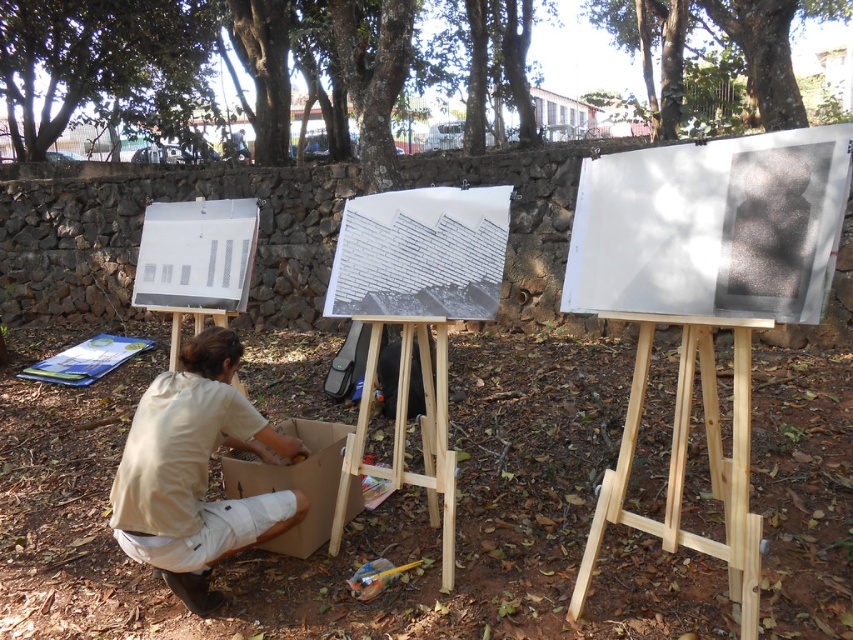
Looking at this image, who is more distant from viewer, (668, 483) or (126, 35)?

The point (126, 35) is behind.

Between wooden easel at center and green leafy tree at upper left, which one is positioned lower?

wooden easel at center is below.

Who is more forward, [758,241] or [125,29]?

Result: Positioned in front is point [758,241].

Locate an element on the screen. The image size is (853, 640). wooden easel at center is located at coordinates point(705,300).

Between white paper at center and green leafy tree at upper center, which one is positioned higher?

Positioned higher is green leafy tree at upper center.

Which is in front, point (474, 296) or point (802, 122)?

Point (474, 296) is in front.

Which is in front, point (440, 452) or point (664, 44)?

Point (440, 452) is in front.

Find the location of `white paper at center`. white paper at center is located at coordinates (416, 317).

Is the position of white paper at center more distant than that of white paper at left?

No, white paper at center is closer to the viewer.

Does point (434, 403) lie behind point (233, 298)?

No, (434, 403) is in front of (233, 298).

Image resolution: width=853 pixels, height=640 pixels. I want to click on white paper at center, so click(x=416, y=317).

Where is `white paper at center`? white paper at center is located at coordinates (416, 317).